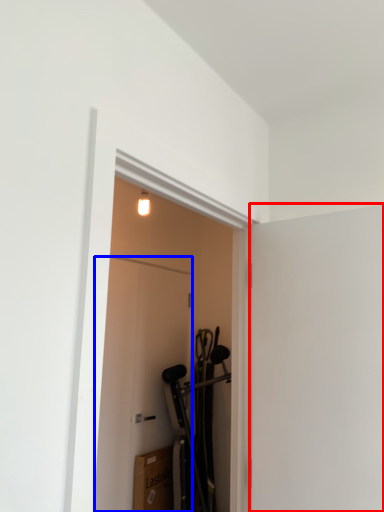
Question: Which object is further to the camera taking this photo, screen door (highlighted by a red box) or door (highlighted by a blue box)?

Choices:
 (A) screen door
 (B) door

Answer: (B)